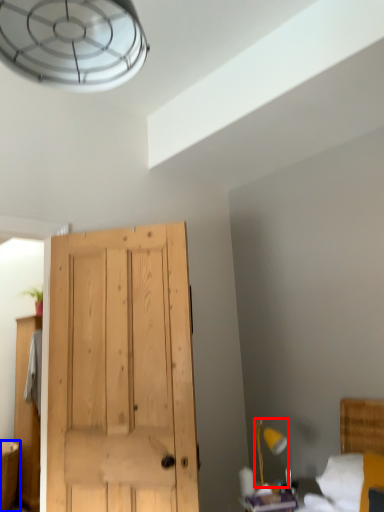
Question: Among these objects, which one is nearest to the camera, light fixture (highlighted by a red box) or vanity (highlighted by a blue box)?

Choices:
 (A) light fixture
 (B) vanity

Answer: (A)